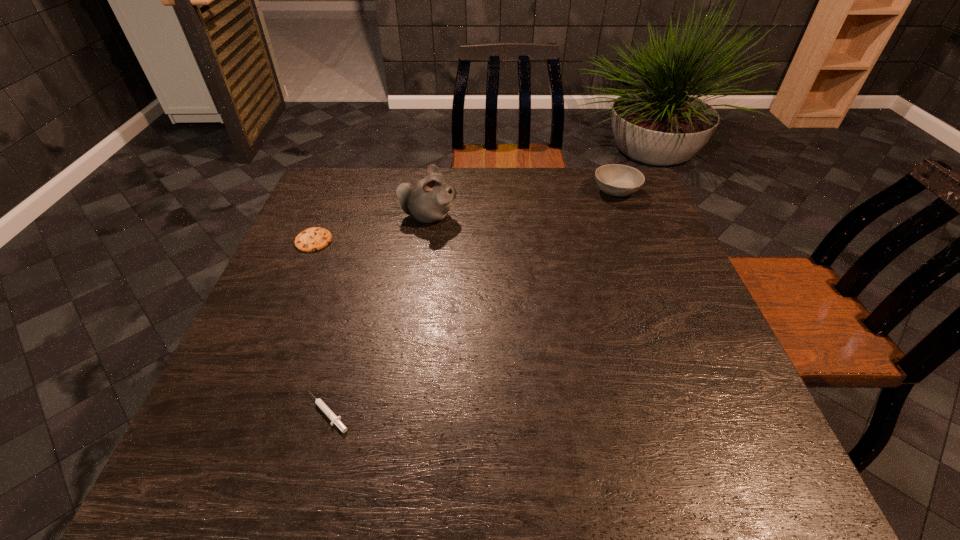
Where is `the tallest object`? This screenshot has width=960, height=540. the tallest object is located at coordinates (428, 200).

I want to click on the third object from left to right, so click(428, 200).

The image size is (960, 540). Find the location of `the second tallest object`. the second tallest object is located at coordinates (617, 180).

Image resolution: width=960 pixels, height=540 pixels. Identify the location of bowl. (617, 180).

Locate an element on the screen. This screenshot has height=540, width=960. cookie is located at coordinates (313, 239).

This screenshot has height=540, width=960. I want to click on the leftmost object, so click(x=313, y=239).

Locate an element on the screen. syringe is located at coordinates (335, 420).

Find the location of a particular element. the second object from left to right is located at coordinates (335, 420).

At what (x,y) coordinates should I click in order to perform the action: click on vacant space located 0.290m on the face of the hamster. Please return your answer as a coordinate pair (x, y). Looking at the image, I should click on (559, 217).

Where is `vacant space located on the front of the bowl`? vacant space located on the front of the bowl is located at coordinates (646, 266).